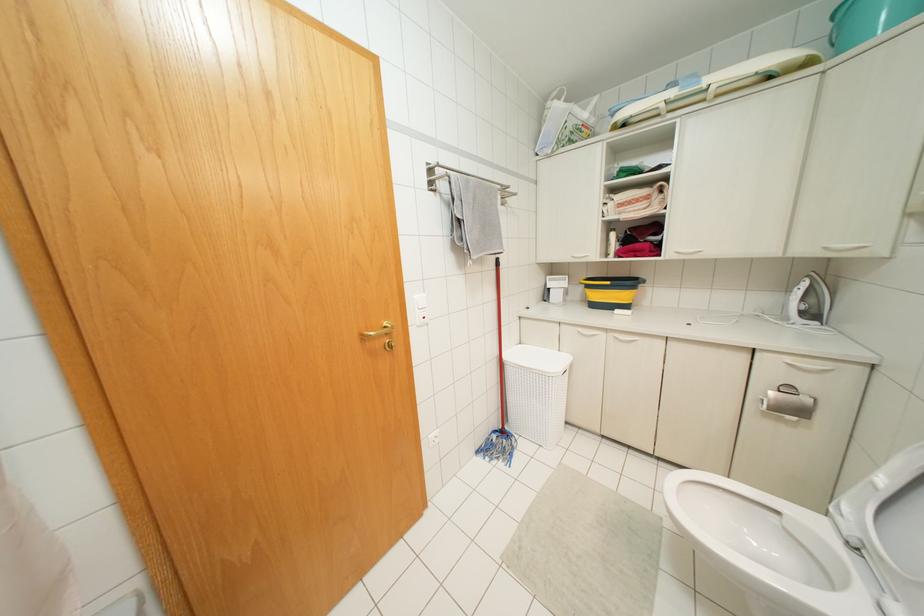
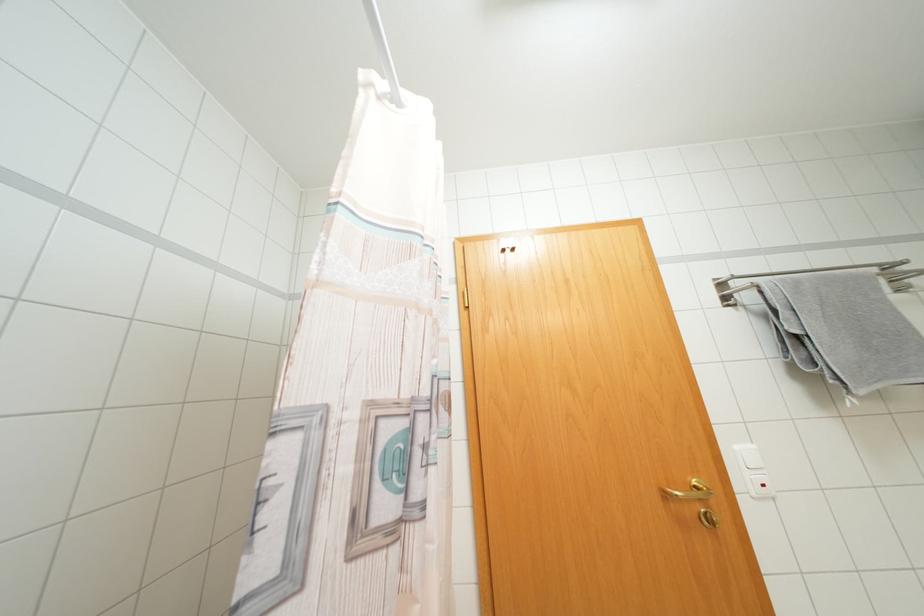
Find the pixel in the second image that matches (x=480, y=254) in the first image.

(877, 386)